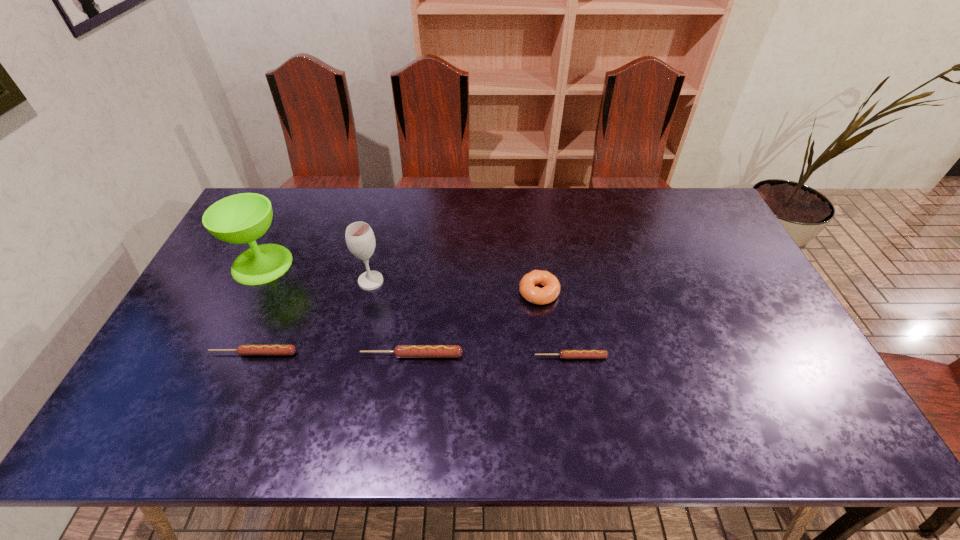
What are the coordinates of `free location located 0.400m on the left of the shortest object` in the screenshot? It's located at (379, 357).

This screenshot has width=960, height=540. What are the coordinates of `vacant space situated 0.260m on the front of the doughnut` in the screenshot? It's located at (551, 390).

At what (x,y) coordinates should I click in order to perform the action: click on vacant space located 0.330m on the right of the left wineglass. Please return your answer as a coordinate pair (x, y). Looking at the image, I should click on (397, 264).

Find the location of a particular element. vacant space located 0.180m on the front of the right wineglass is located at coordinates (357, 341).

In order to click on sausage that is at the left edge in this screenshot , I will do `click(241, 349)`.

The height and width of the screenshot is (540, 960). What are the coordinates of `wineglass positioned at the left edge` in the screenshot? It's located at (242, 218).

The image size is (960, 540). I want to click on vacant area at the far edge of the desktop, so 353,210.

This screenshot has height=540, width=960. What are the coordinates of `vacant region at the near edge of the desktop` in the screenshot? It's located at (739, 376).

You are a GUI agent. You are given a task and a screenshot of the screen. Output one action in this format:
    pyautogui.click(x=<x>, y=<y>)
    Task: Click on the blank space at the left edge of the desktop
    This screenshot has height=540, width=960.
    Given the screenshot: What is the action you would take?
    pyautogui.click(x=198, y=312)

Locate an element on the screen. vacant space at the right edge of the desktop is located at coordinates (703, 274).